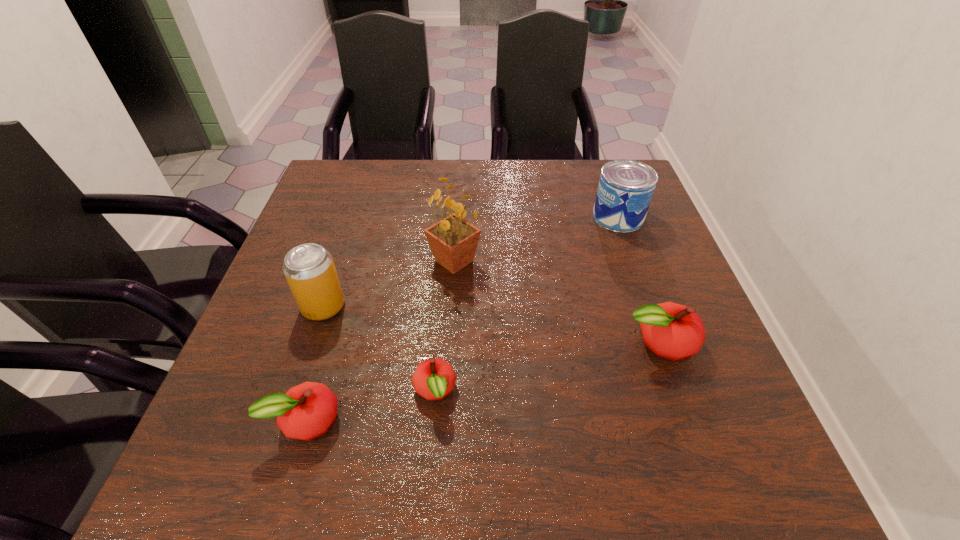
In order to click on pop (soda) that is at the left edge in this screenshot , I will do `click(309, 269)`.

Where is `apple situated at the right edge`? apple situated at the right edge is located at coordinates (673, 331).

Find the location of `can that is at the right edge`. can that is at the right edge is located at coordinates (625, 189).

Image resolution: width=960 pixels, height=540 pixels. Find the location of `object situated at the near left corner`. object situated at the near left corner is located at coordinates (306, 411).

Locate an element on the screen. object positioned at the far right corner is located at coordinates (625, 189).

Locate an element on the screen. vacant area at the far edge is located at coordinates (547, 182).

This screenshot has width=960, height=540. I want to click on free space at the near edge of the desktop, so click(x=564, y=401).

Identify the location of free space at the left edge of the desktop. The height and width of the screenshot is (540, 960). (360, 224).

The image size is (960, 540). In the image, there is a desktop. Find the location of `free space at the far left corner`. free space at the far left corner is located at coordinates (365, 198).

Where is `empty location between the second shortest apple and the pop (soda)`? Image resolution: width=960 pixels, height=540 pixels. empty location between the second shortest apple and the pop (soda) is located at coordinates (315, 363).